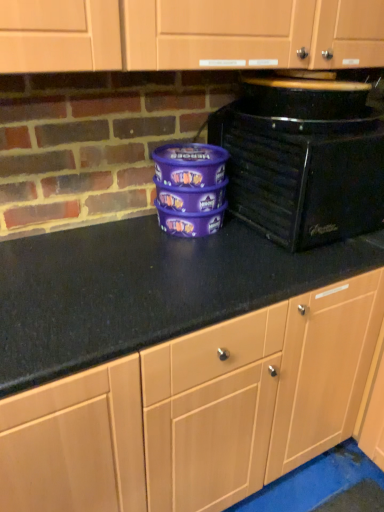
The image size is (384, 512). What do you see at coordinates (303, 173) in the screenshot? I see `black plastic microwave at right` at bounding box center [303, 173].

You are a GUI agent. You are given a task and a screenshot of the screen. Output one action in this format:
    pyautogui.click(x=<x>, y=<y>)
    Task: Click on the black plastic microwave at right
    The width and height of the screenshot is (384, 512).
    Given the screenshot: What is the action you would take?
    pyautogui.click(x=303, y=173)

Find the location of a particular element. This screenshot has width=384, height=512. black plastic microwave at right is located at coordinates (303, 173).